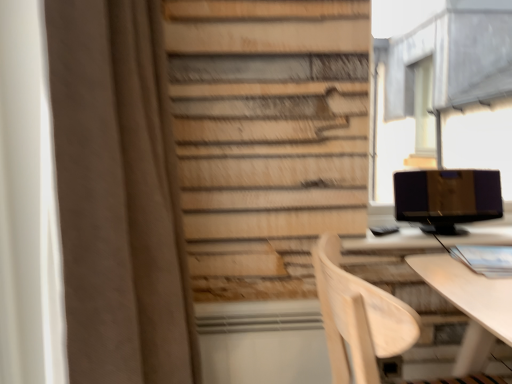
In order to click on vacant space in matte black monitor at right (from a real-world perspective) in this screenshot , I will do `click(436, 231)`.